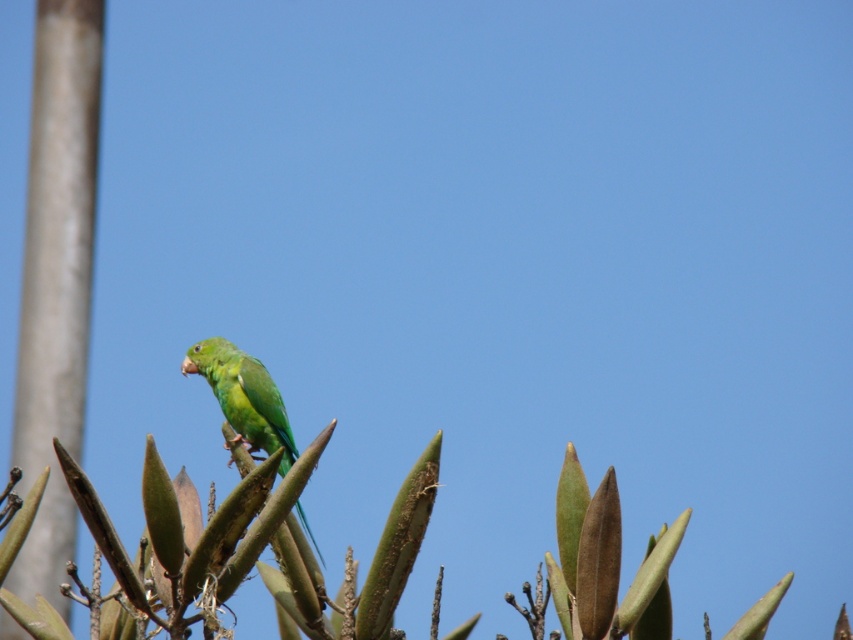
Question: Is smooth gray pole at left below green matte parrot at center?

Choices:
 (A) yes
 (B) no

Answer: (B)

Question: Is smooth gray pole at left wider than green matte parrot at center?

Choices:
 (A) yes
 (B) no

Answer: (B)

Question: Considering the relative positions of smooth gray pole at left and green matte parrot at center in the image provided, where is smooth gray pole at left located with respect to green matte parrot at center?

Choices:
 (A) left
 (B) right

Answer: (A)

Question: Which point is closer to the camera?

Choices:
 (A) green matte parrot at center
 (B) smooth gray pole at left

Answer: (A)

Question: Which point appears farthest from the camera in this image?

Choices:
 (A) (83, 154)
 (B) (247, 442)

Answer: (A)

Question: Which point is closer to the camera?

Choices:
 (A) smooth gray pole at left
 (B) green matte parrot at center

Answer: (B)